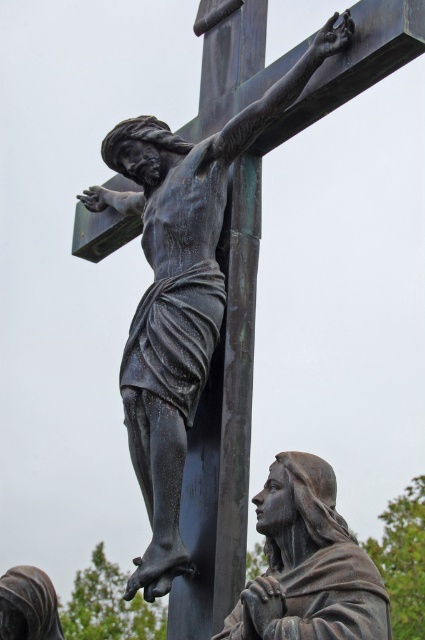
You are an art conservator examining the bronze sculpture of the crucifixion scene. You notice a specific point at coordinates (195, 168). Based on the scene description, what does this point likely represent?

The point at coordinates (195, 168) indicates the bronze statue at center.

Based on the scene described, which object takes up more space in the image? Please choose between the bronze cross at center and the bronze statue at center.

The bronze statue at center takes up more space than the bronze cross at center.